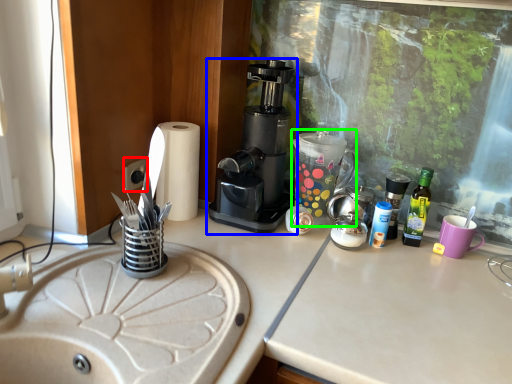
Question: Which object is positioned farthest from electric outlet (highlighted by a red box)? Select from coffee maker (highlighted by a blue box) and coffeepot (highlighted by a green box).

Choices:
 (A) coffee maker
 (B) coffeepot

Answer: (B)